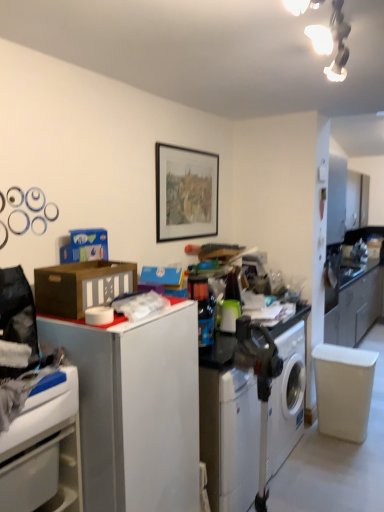
The width and height of the screenshot is (384, 512). Identify the location of free space above matte black picture frame at center (from a real-world perspective). (187, 146).